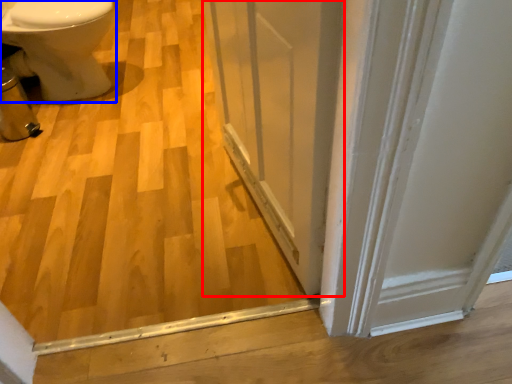
Question: Among these objects, which one is farthest to the camera, screen door (highlighted by a red box) or bidet (highlighted by a blue box)?

Choices:
 (A) screen door
 (B) bidet

Answer: (B)